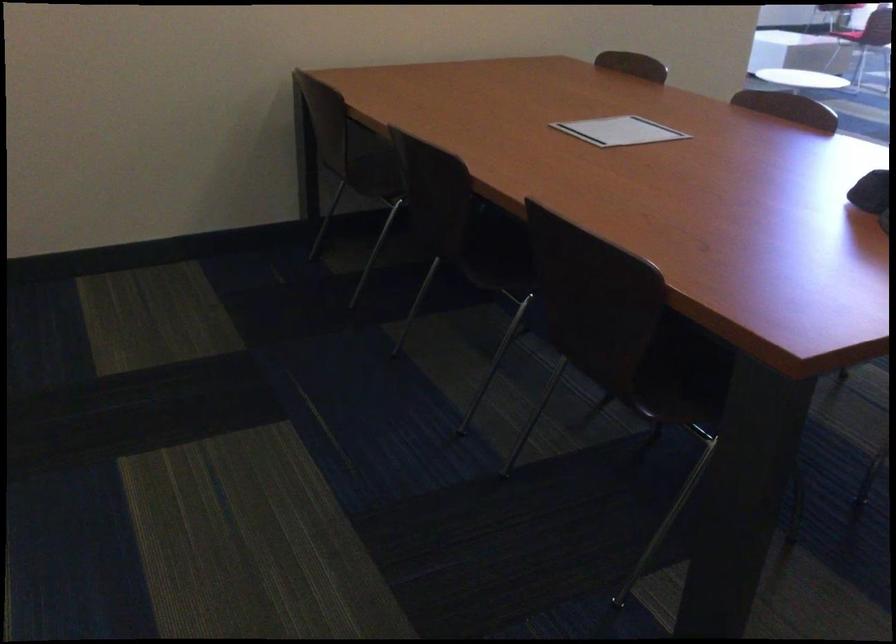
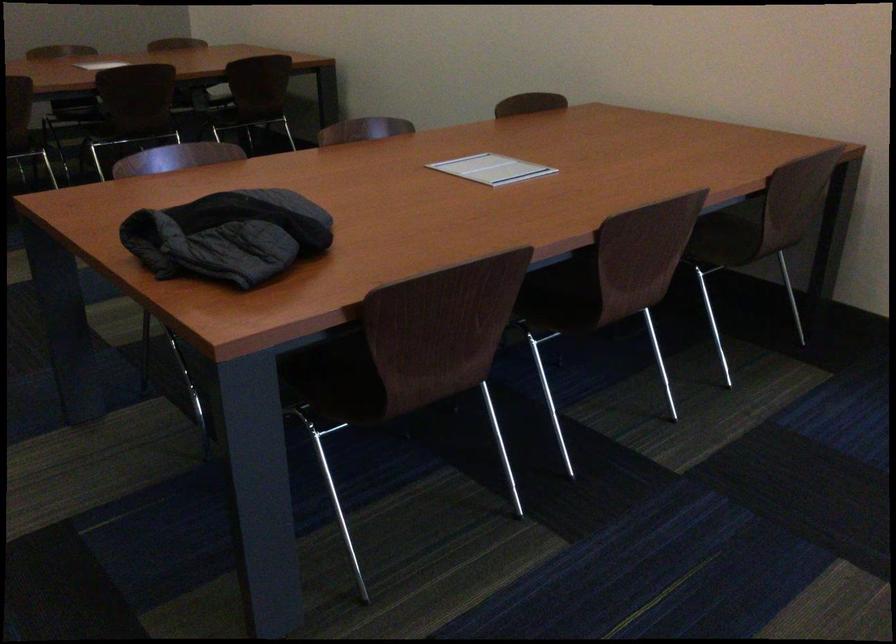
Question: I am providing you with two images of the same scene from different viewpoints. After the viewpoint changes to image2, which objects are now occluded?

Choices:
 (A) brown chair sitting surface
 (B) dark quilted jacket
 (C) silver pushpin
 (D) chair sitting surface

Answer: (A)